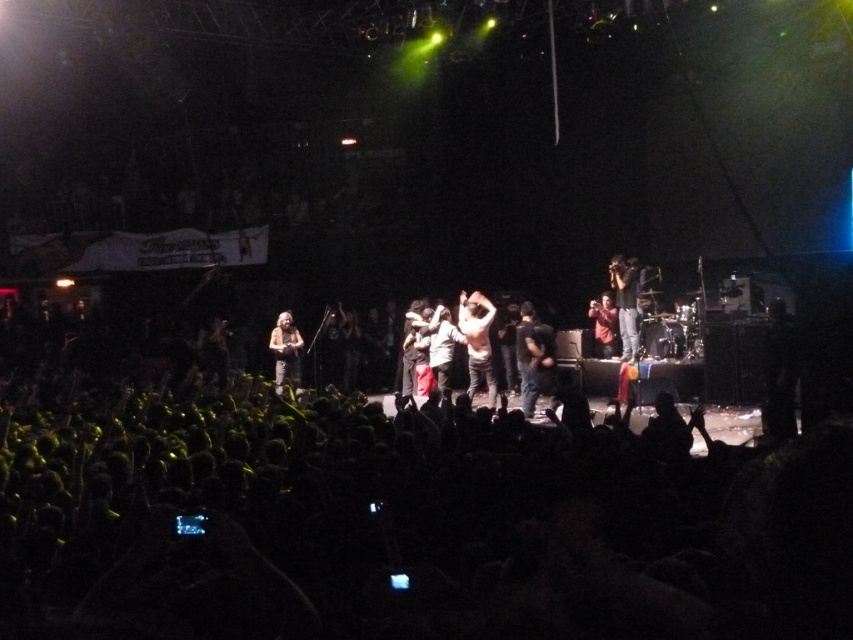
Question: From the image, what is the correct spatial relationship of shiny silver shirt at center in relation to shiny gold guitar at center?

Choices:
 (A) above
 (B) below

Answer: (A)

Question: Does shiny silver shirt at center appear over matte black camera at right?

Choices:
 (A) no
 (B) yes

Answer: (A)

Question: Based on their relative distances, which object is farther from the light brown leather jacket at center?

Choices:
 (A) matte black camera at right
 (B) shiny silver shirt at center

Answer: (A)

Question: Does shiny silver shirt at center have a smaller size compared to shiny gold guitar at center?

Choices:
 (A) no
 (B) yes

Answer: (A)

Question: Which point is farther from the camera taking this photo?

Choices:
 (A) (619, 321)
 (B) (294, 332)

Answer: (B)

Question: Among these objects, which one is nearest to the camera?

Choices:
 (A) matte black shirt at center
 (B) matte black camera at right
 (C) black fabric crowd at lower center
 (D) light brown leather jacket at center

Answer: (C)